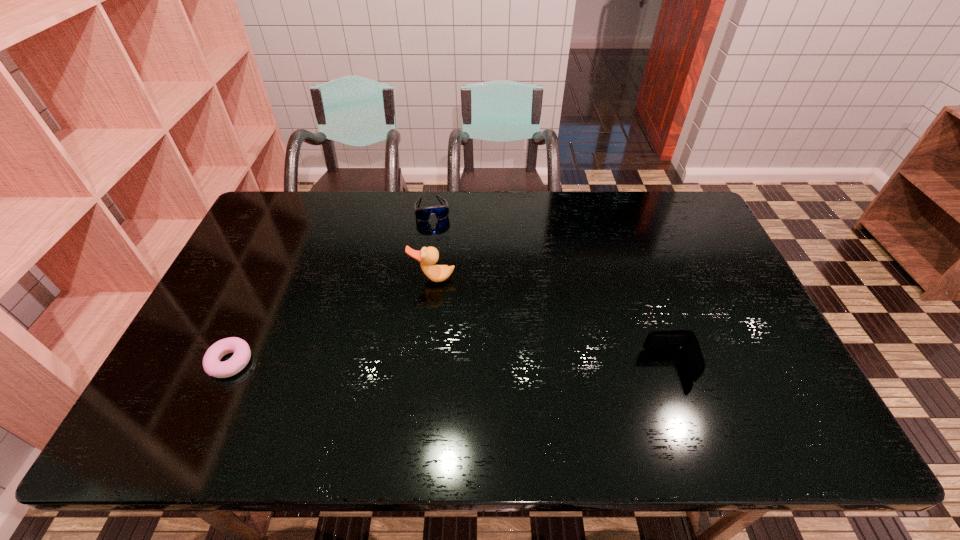
Identify the location of free space between the shortest object and the tallest object. (331, 320).

Find the location of `free space that is in between the rightmost object and the leftmost object`. free space that is in between the rightmost object and the leftmost object is located at coordinates (449, 364).

Where is `free space between the pastry and the tallest object`? The height and width of the screenshot is (540, 960). free space between the pastry and the tallest object is located at coordinates (331, 320).

I want to click on unoccupied position between the tallest object and the second tallest object, so click(x=550, y=322).

I want to click on unoccupied position between the second tallest object and the second farthest object, so click(550, 322).

This screenshot has height=540, width=960. Identify the location of free space between the tallest object and the third tallest object. (433, 244).

The width and height of the screenshot is (960, 540). In order to click on free area in between the third tallest object and the pastry in this screenshot , I will do `click(331, 285)`.

Image resolution: width=960 pixels, height=540 pixels. Identify the location of vacant point located between the wallet and the pastry. (449, 364).

Find the location of a particular element. The height and width of the screenshot is (540, 960). free space between the tallest object and the wallet is located at coordinates (550, 322).

Identify the location of empty space between the sunglasses and the duck. (433, 244).